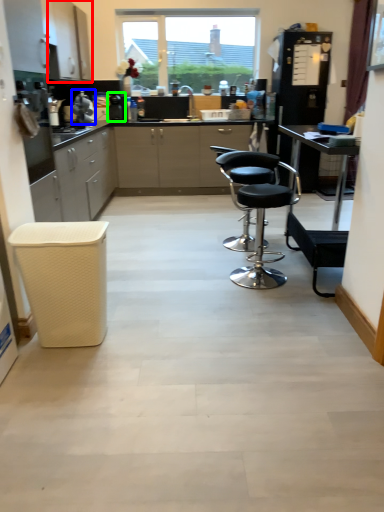
Question: Which object is the closest to the cabinetry (highlighted by a red box)? Choose among these: appliance (highlighted by a blue box) or appliance (highlighted by a green box).

Choices:
 (A) appliance
 (B) appliance

Answer: (A)